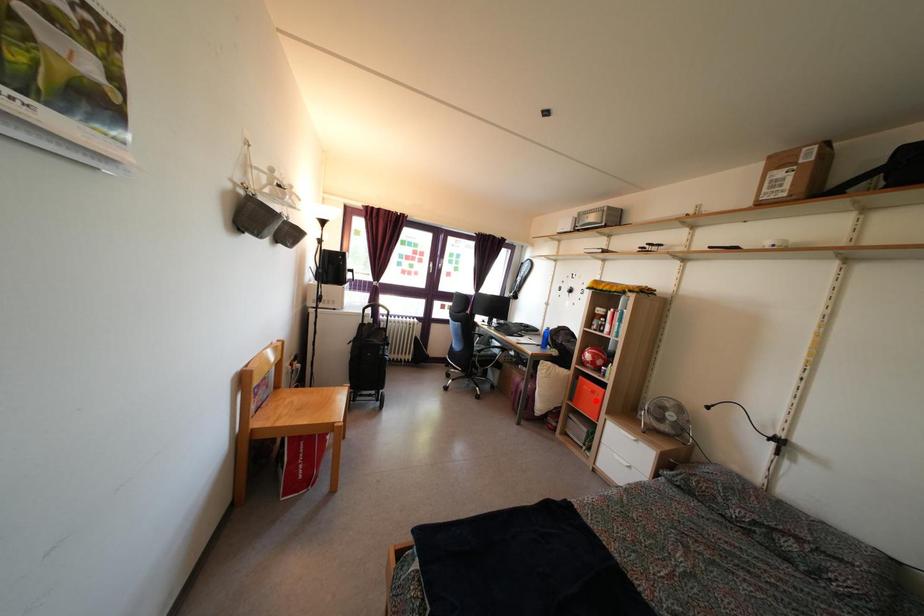
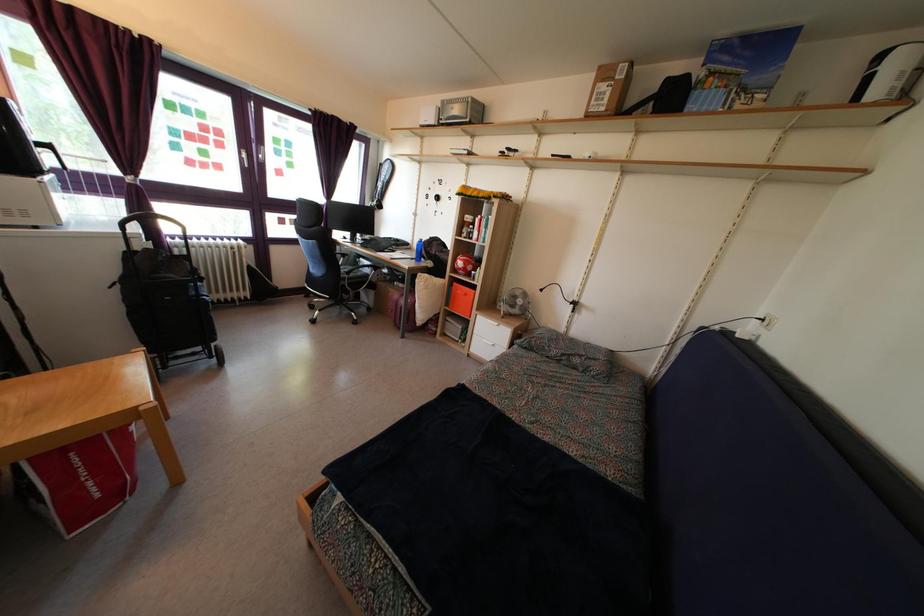
Find the pixel in the second image that matches the highlighted location in the first image.

(468, 302)